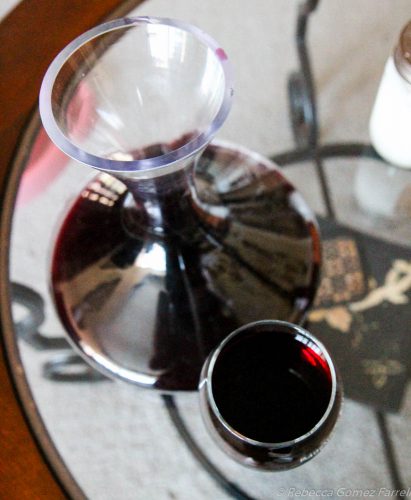
Image resolution: width=411 pixels, height=500 pixels. Find the location of `table`. table is located at coordinates (63, 35).